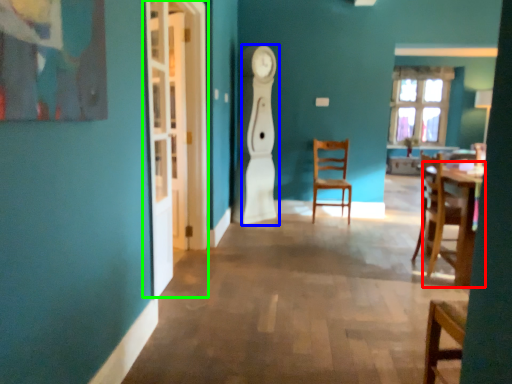
Question: Considering the real-world distances, which object is farthest from table (highlighted by a red box)? wide (highlighted by a blue box) or glass door (highlighted by a green box)?

Choices:
 (A) wide
 (B) glass door

Answer: (B)